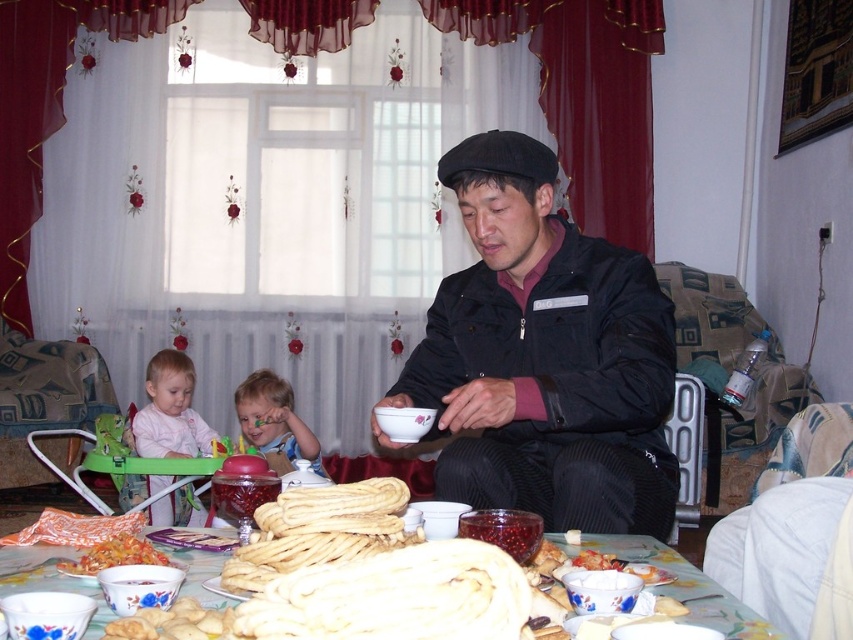
How far apart are matte black jacket at center and matte ceramic bowl at lower left?

matte black jacket at center and matte ceramic bowl at lower left are 31.28 inches apart from each other.

Does matte black jacket at center have a smaller size compared to matte ceramic bowl at lower left?

No.

Between point (524, 301) and point (73, 566), which one is positioned in front?

Positioned in front is point (73, 566).

Image resolution: width=853 pixels, height=640 pixels. In order to click on matte black jacket at center in this screenshot , I will do pyautogui.click(x=544, y=356).

Does white ceramic table at lower center appear on the right side of matte ceramic bowl at lower left?

Indeed, white ceramic table at lower center is positioned on the right side of matte ceramic bowl at lower left.

Is the position of white ceramic table at lower center less distant than that of matte ceramic bowl at lower left?

Yes, white ceramic table at lower center is closer to the viewer.

You are a GUI agent. You are given a task and a screenshot of the screen. Output one action in this format:
    pyautogui.click(x=<x>, y=<y>)
    Task: Click on the white ceramic table at lower center
    The width and height of the screenshot is (853, 640).
    Given the screenshot: What is the action you would take?
    pyautogui.click(x=683, y=586)

Locate an element on the screen. This screenshot has width=853, height=640. white ceramic table at lower center is located at coordinates (683, 586).

Measure the distance between matte black jacket at center and smooth plastic spoon at center.

A distance of 4.14 feet exists between matte black jacket at center and smooth plastic spoon at center.

Is point (625, 508) behind point (247, 429)?

No.

This screenshot has height=640, width=853. I want to click on matte black jacket at center, so click(544, 356).